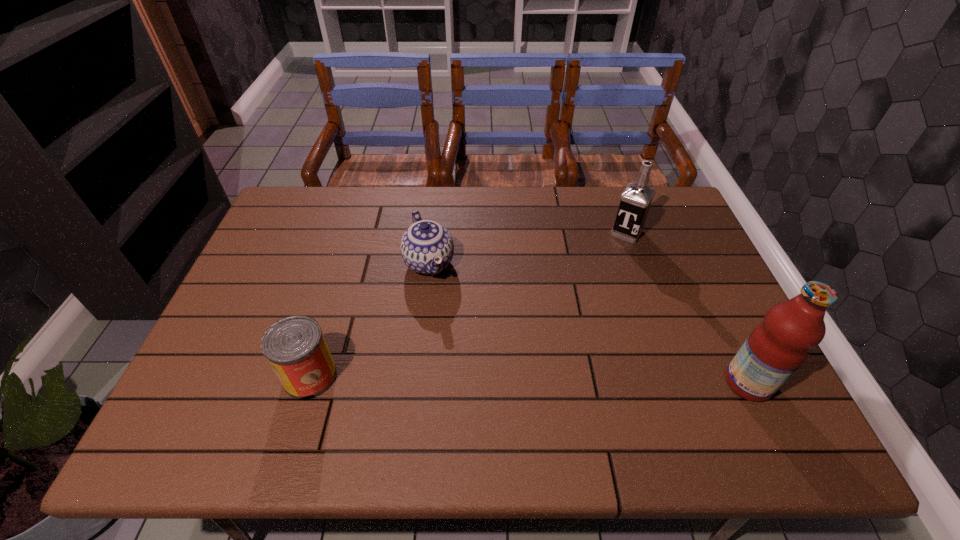
At what (x,y) coordinates should I click in order to perform the action: click on the leftmost object. Please return your answer as a coordinate pair (x, y). Looking at the image, I should click on (295, 347).

You are a GUI agent. You are given a task and a screenshot of the screen. Output one action in this format:
    pyautogui.click(x=<x>, y=<y>)
    Task: Click on the rightmost object
    The width and height of the screenshot is (960, 540).
    Given the screenshot: What is the action you would take?
    pyautogui.click(x=777, y=347)

This screenshot has height=540, width=960. I want to click on fruit juice, so click(x=777, y=347).

This screenshot has width=960, height=540. What are the coordinates of `vodka` in the screenshot? It's located at (636, 199).

Locate an element on the screen. The width and height of the screenshot is (960, 540). the second tallest object is located at coordinates (636, 199).

This screenshot has width=960, height=540. Find the location of `the third object from right to left`. the third object from right to left is located at coordinates [x=427, y=247].

The width and height of the screenshot is (960, 540). Identify the location of vacant position located 0.350m on the right of the can. (487, 376).

Find the location of a particular element. The width and height of the screenshot is (960, 540). free region located on the front label of the second object from right to left is located at coordinates (605, 267).

The height and width of the screenshot is (540, 960). In order to click on free space located on the front label of the second object from right to left in this screenshot , I will do `click(583, 303)`.

Where is `vacant space located on the front label of the second object from right to left`? vacant space located on the front label of the second object from right to left is located at coordinates (583, 303).